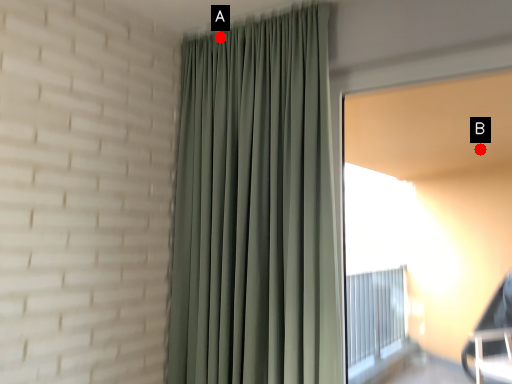
Question: Two points are circled on the image, labeled by A and B beside each circle. Which point is further to the camera?

Choices:
 (A) A is further
 (B) B is further

Answer: (B)